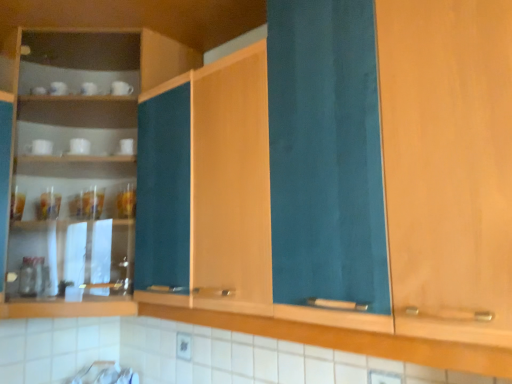
Where is `white glossy cup at left`? The height and width of the screenshot is (384, 512). white glossy cup at left is located at coordinates (39, 147).

This screenshot has height=384, width=512. Describe the element at coordinates (39, 147) in the screenshot. I see `white glossy cup at left` at that location.

Image resolution: width=512 pixels, height=384 pixels. I want to click on teal fabric cabinet at center, which is counted as the 2th cabinetry, starting from the left, so click(x=231, y=182).

Consider the image. Is teal fabric cabinet at center, which is counted as the 2th cabinetry, starting from the left, outside of wooden cabinet at left, the 2th cabinetry from the right?

Yes, teal fabric cabinet at center, which is counted as the 2th cabinetry, starting from the left, is not within wooden cabinet at left, the 2th cabinetry from the right.

From the picture: Which object is positioned more to the left, teal fabric cabinet at center, which is counted as the 1th cabinetry, starting from the right, or wooden cabinet at left, which ranks as the first cabinetry in left-to-right order?

From the viewer's perspective, wooden cabinet at left, which ranks as the first cabinetry in left-to-right order, appears more on the left side.

Who is smaller, teal fabric cabinet at center, which is counted as the 2th cabinetry, starting from the left, or wooden cabinet at left, which ranks as the first cabinetry in left-to-right order?

Smaller between the two is teal fabric cabinet at center, which is counted as the 2th cabinetry, starting from the left.

From the image's perspective, is teal fabric cabinet at center, which is counted as the 1th cabinetry, starting from the right, below wooden cabinet at left, the 2th cabinetry from the right?

Yes.

Can you confirm if white glossy cup at left is positioned to the left of teal fabric cabinet at center, which is counted as the 2th cabinetry, starting from the left?

Correct, you'll find white glossy cup at left to the left of teal fabric cabinet at center, which is counted as the 2th cabinetry, starting from the left.

Between white glossy cup at left and teal fabric cabinet at center, which is counted as the 1th cabinetry, starting from the right, which one is positioned behind?

white glossy cup at left is behind.

Considering the relative sizes of white glossy cup at left and teal fabric cabinet at center, which is counted as the 1th cabinetry, starting from the right, in the image provided, is white glossy cup at left taller than teal fabric cabinet at center, which is counted as the 1th cabinetry, starting from the right,?

In fact, white glossy cup at left may be shorter than teal fabric cabinet at center, which is counted as the 1th cabinetry, starting from the right.

Can you confirm if white glossy cup at left is bigger than teal fabric cabinet at center, which is counted as the 1th cabinetry, starting from the right?

No.

Is wooden cabinet at left, which ranks as the first cabinetry in left-to-right order, oriented away from teal fabric cabinet at center, which is counted as the 1th cabinetry, starting from the right?

No.

Which is in front, point (106, 68) or point (220, 189)?

The point (220, 189) is closer.

Considering the positions of objects wooden cabinet at left, which ranks as the first cabinetry in left-to-right order, and teal fabric cabinet at center, which is counted as the 1th cabinetry, starting from the right, in the image provided, who is more to the left, wooden cabinet at left, which ranks as the first cabinetry in left-to-right order, or teal fabric cabinet at center, which is counted as the 1th cabinetry, starting from the right,?

wooden cabinet at left, which ranks as the first cabinetry in left-to-right order.

How much distance is there between wooden cabinet at left, which ranks as the first cabinetry in left-to-right order, and teal fabric cabinet at center, which is counted as the 1th cabinetry, starting from the right?

The distance of wooden cabinet at left, which ranks as the first cabinetry in left-to-right order, from teal fabric cabinet at center, which is counted as the 1th cabinetry, starting from the right, is 23.28 inches.

Is white glossy cup at left at the back of teal fabric cabinet at center, which is counted as the 1th cabinetry, starting from the right?

teal fabric cabinet at center, which is counted as the 1th cabinetry, starting from the right, is not turned away from white glossy cup at left.

From the picture: From the image's perspective, is teal fabric cabinet at center, which is counted as the 1th cabinetry, starting from the right, below white glossy cup at left?

Indeed, from the image's perspective, teal fabric cabinet at center, which is counted as the 1th cabinetry, starting from the right, is shown beneath white glossy cup at left.

Which of these two, teal fabric cabinet at center, which is counted as the 2th cabinetry, starting from the left, or white glossy cup at left, stands taller?

teal fabric cabinet at center, which is counted as the 2th cabinetry, starting from the left, is taller.

Based on the photo, between teal fabric cabinet at center, which is counted as the 1th cabinetry, starting from the right, and white glossy cup at left, which one appears on the right side from the viewer's perspective?

teal fabric cabinet at center, which is counted as the 1th cabinetry, starting from the right, is more to the right.

Which is more to the left, white glossy cup at left or wooden cabinet at left, which ranks as the first cabinetry in left-to-right order?

From the viewer's perspective, white glossy cup at left appears more on the left side.

Which point is more forward, (38, 149) or (46, 102)?

The point (38, 149) is more forward.

Considering the sizes of objects white glossy cup at left and wooden cabinet at left, the 2th cabinetry from the right, in the image provided, who is thinner, white glossy cup at left or wooden cabinet at left, the 2th cabinetry from the right,?

white glossy cup at left.

Would you say wooden cabinet at left, the 2th cabinetry from the right, is part of white glossy cup at left's contents?

Actually, wooden cabinet at left, the 2th cabinetry from the right, is outside white glossy cup at left.

Is point (17, 172) closer or farther from the camera than point (45, 145)?

Point (17, 172) is positioned farther from the camera compared to point (45, 145).

Which object is positioned more to the left, wooden cabinet at left, the 2th cabinetry from the right, or white glossy cup at left?

white glossy cup at left.

Find the location of a particular element. The height and width of the screenshot is (384, 512). tableware positioned vertically above the wooden cabinet at left, the 2th cabinetry from the right (from a real-world perspective) is located at coordinates (39, 147).

Does wooden cabinet at left, which ranks as the first cabinetry in left-to-right order, have a greater height compared to white glossy cup at left?

Indeed, wooden cabinet at left, which ranks as the first cabinetry in left-to-right order, has a greater height compared to white glossy cup at left.

Locate an element on the screen. The height and width of the screenshot is (384, 512). cabinetry to the right of wooden cabinet at left, which ranks as the first cabinetry in left-to-right order is located at coordinates (231, 182).

Find the location of a particular element. The height and width of the screenshot is (384, 512). tableware located behind the teal fabric cabinet at center, which is counted as the 2th cabinetry, starting from the left is located at coordinates (39, 147).

Considering their positions, is white glossy cup at left positioned closer to wooden cabinet at left, the 2th cabinetry from the right, than teal fabric cabinet at center, which is counted as the 2th cabinetry, starting from the left?

Among the two, white glossy cup at left is located nearer to wooden cabinet at left, the 2th cabinetry from the right.

Which object lies further to the anchor point teal fabric cabinet at center, which is counted as the 1th cabinetry, starting from the right, wooden cabinet at left, the 2th cabinetry from the right, or white glossy cup at left?

white glossy cup at left.

Based on their spatial positions, is white glossy cup at left or wooden cabinet at left, the 2th cabinetry from the right, closer to teal fabric cabinet at center, which is counted as the 1th cabinetry, starting from the right?

Among the two, wooden cabinet at left, the 2th cabinetry from the right, is located nearer to teal fabric cabinet at center, which is counted as the 1th cabinetry, starting from the right.

Looking at the image, which one is located further to white glossy cup at left, teal fabric cabinet at center, which is counted as the 1th cabinetry, starting from the right, or wooden cabinet at left, the 2th cabinetry from the right?

Based on the image, teal fabric cabinet at center, which is counted as the 1th cabinetry, starting from the right, appears to be further to white glossy cup at left.

From the image, which object appears to be nearer to white glossy cup at left, wooden cabinet at left, the 2th cabinetry from the right, or teal fabric cabinet at center, which is counted as the 1th cabinetry, starting from the right?

wooden cabinet at left, the 2th cabinetry from the right, is positioned closer to the anchor white glossy cup at left.

Estimate the real-world distances between objects in this image. Which object is further from wooden cabinet at left, which ranks as the first cabinetry in left-to-right order, teal fabric cabinet at center, which is counted as the 1th cabinetry, starting from the right, or white glossy cup at left?

teal fabric cabinet at center, which is counted as the 1th cabinetry, starting from the right, is positioned further to the anchor wooden cabinet at left, which ranks as the first cabinetry in left-to-right order.

Identify the location of cabinetry between white glossy cup at left and teal fabric cabinet at center, which is counted as the 1th cabinetry, starting from the right, in the horizontal direction. The height and width of the screenshot is (384, 512). (81, 163).